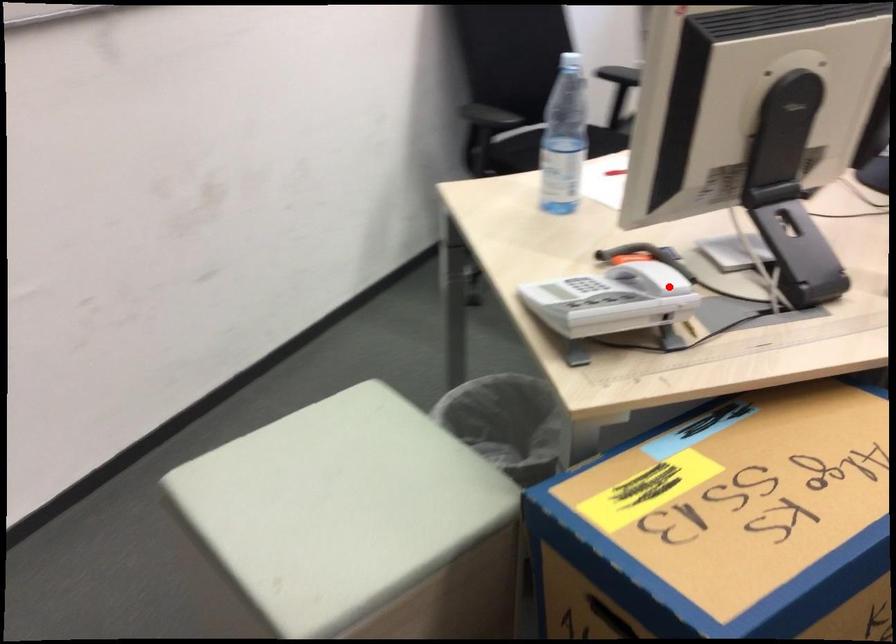
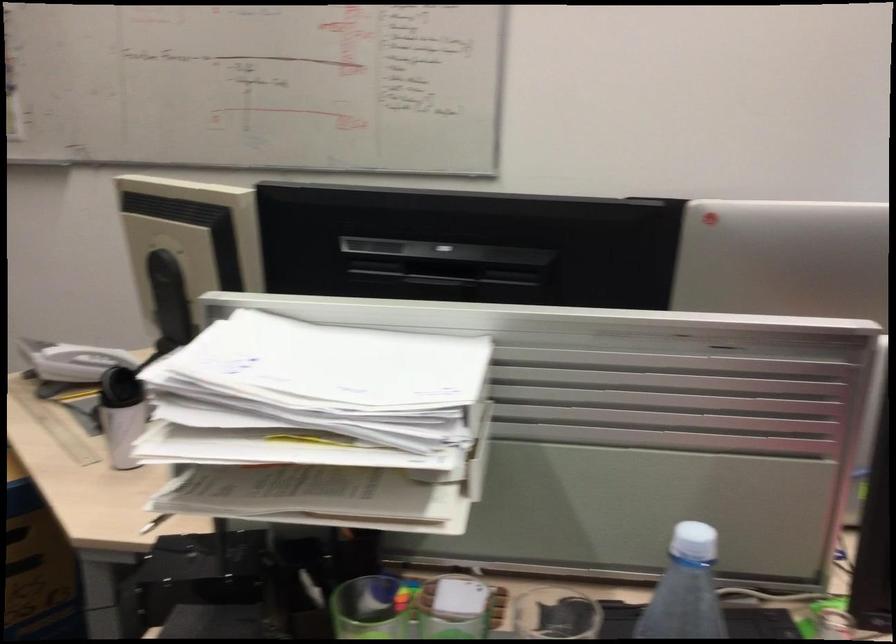
Where in the second image is the point corresponding to the highlighted location from the first image?

(72, 361)